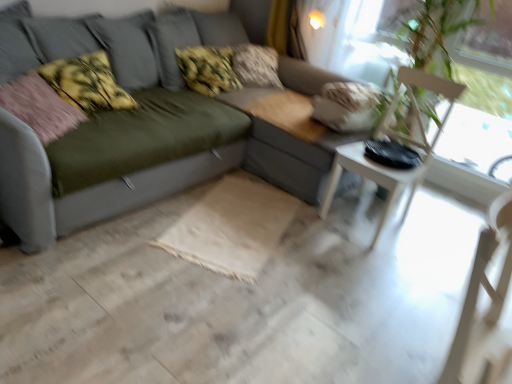
Question: Based on their sizes in the image, would you say transparent glass window screen at upper right is bigger or smaller than fluffy beige pillow at upper center, the 4th pillow in the front-to-back sequence?

Choices:
 (A) small
 (B) big

Answer: (B)

Question: Is transparent glass window screen at upper right spatially inside fluffy beige pillow at upper center, the first pillow from the back, or outside of it?

Choices:
 (A) outside
 (B) inside

Answer: (A)

Question: Based on their relative distances, which object is nearer to the fluffy beige pillow at upper center, the 4th pillow in the front-to-back sequence?

Choices:
 (A) fluffy pink pillow at left, marked as the 2th pillow in a front-to-back arrangement
 (B) transparent glass window screen at upper right
 (C) white wood armchair at right, marked as the first armchair in a front-to-back arrangement
 (D) green leafy plant at upper right
 (E) white wood chair at right, which ranks as the second armchair in front-to-back order

Answer: (B)

Question: Estimate the real-world distances between objects in this image. Which object is farther from the fluffy beige pillow at upper center, the 4th pillow in the front-to-back sequence?

Choices:
 (A) pink fabric pillow at left, marked as the first pillow in a front-to-back arrangement
 (B) green leafy plant at upper right
 (C) white wood armchair at right, placed as the second armchair when sorted from back to front
 (D) transparent glass window screen at upper right
 (E) matte gray couch at center

Answer: (C)